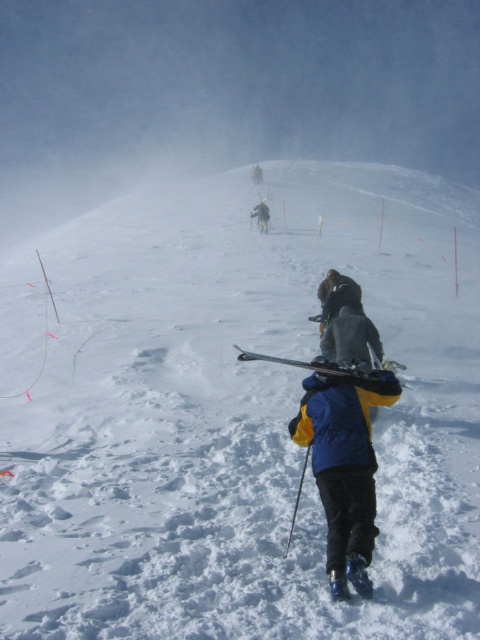
You are a photographer trying to capture a clear photo of the dark gray jacket at center without the shiny metallic ski at center blocking it. What should you do?

Move the camera backward to ensure the dark gray jacket at center is visible without obstruction from the shiny metallic ski at center, which is currently in front of it.